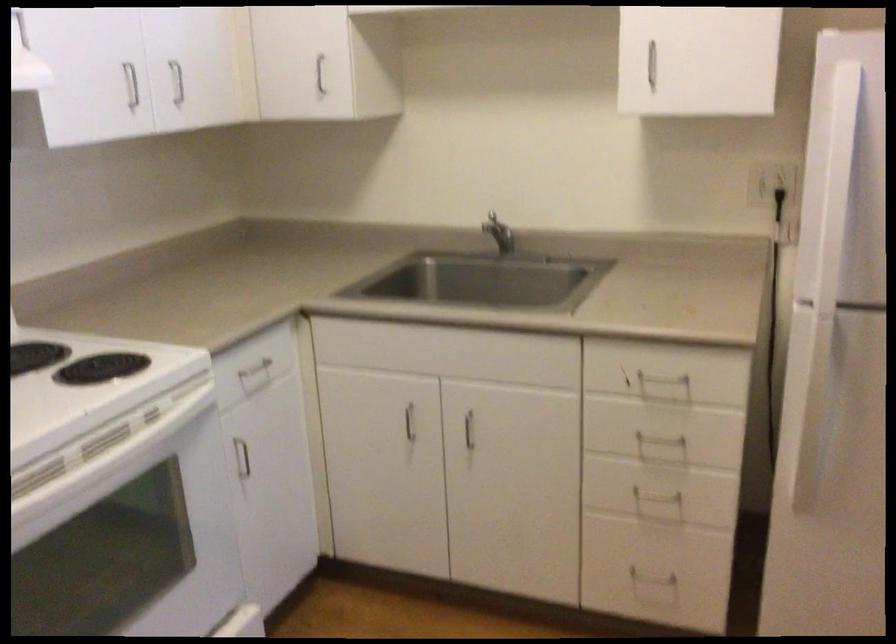
This screenshot has height=644, width=896. Find the location of `refrigerator door handle`. refrigerator door handle is located at coordinates (831, 240).